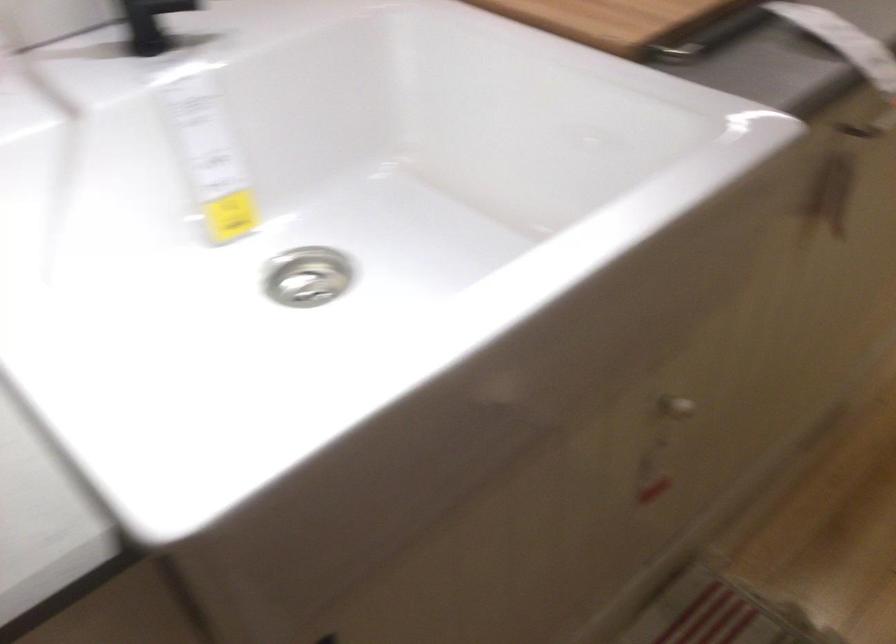
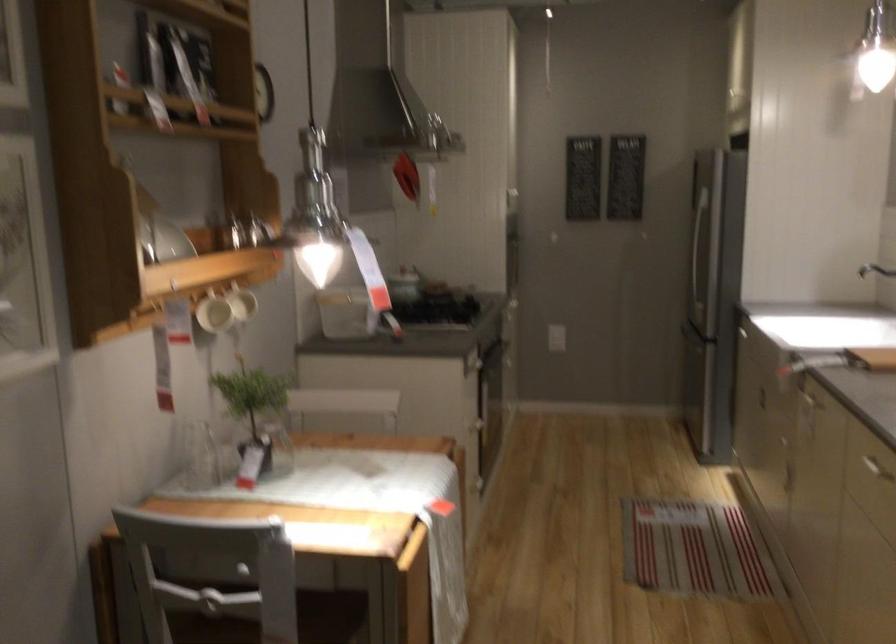
The point at (815, 199) is marked in the first image. Where is the corresponding point in the second image?

(810, 391)